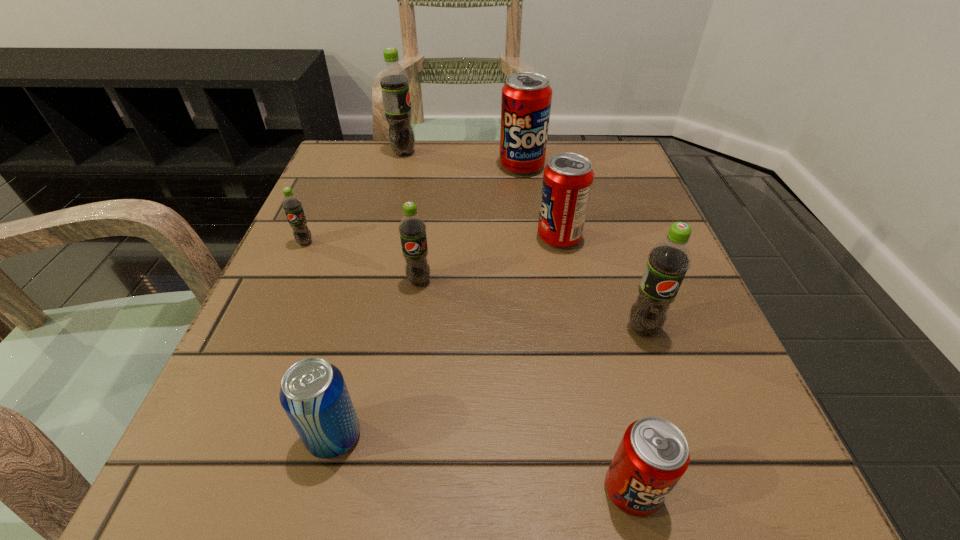
Identify the location of free spot between the seventh farthest object and the second farthest red soda can. Image resolution: width=960 pixels, height=540 pixels. (446, 336).

Identify the location of object that is the second closest to the third smallest green soda. This screenshot has width=960, height=540. (653, 455).

Select which object appears as the closest to the nearest red soda can. Please provide its 2D coordinates. Your answer should be formatted as a tuple, i.e. [(x, y)], where the tuple contains the x and y coordinates of a point satisfying the conditions above.

[(668, 261)]

The image size is (960, 540). What are the coordinates of `soda can that stands as the second closest to the second biggest red soda can` in the screenshot? It's located at (526, 99).

Where is `soda can that stands as the third closest to the leftmost object`? This screenshot has height=540, width=960. soda can that stands as the third closest to the leftmost object is located at coordinates (526, 99).

Identify the location of green soda that can be found as the second closest to the tallest soda can. Image resolution: width=960 pixels, height=540 pixels. (412, 228).

I want to click on green soda that is the third closest to the rightmost green soda, so click(394, 82).

What are the coordinates of `red soda can that is the closest to the second smallest red soda can` in the screenshot? It's located at (526, 99).

At what (x,y) coordinates should I click in order to perform the action: click on the closest red soda can to the second nearest object. Please return your answer as a coordinate pair (x, y). Image resolution: width=960 pixels, height=540 pixels. Looking at the image, I should click on (653, 455).

Locate an element on the screen. vacant region that satisfies the following two spatial constraints: 1. on the front label of the second soda can from left to right; 2. on the left side of the biggest red soda can is located at coordinates (400, 166).